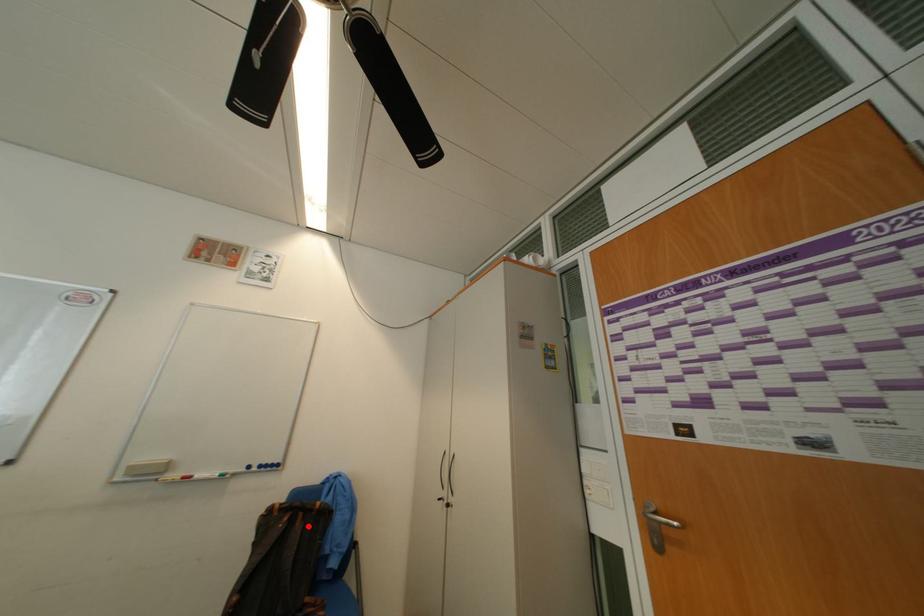
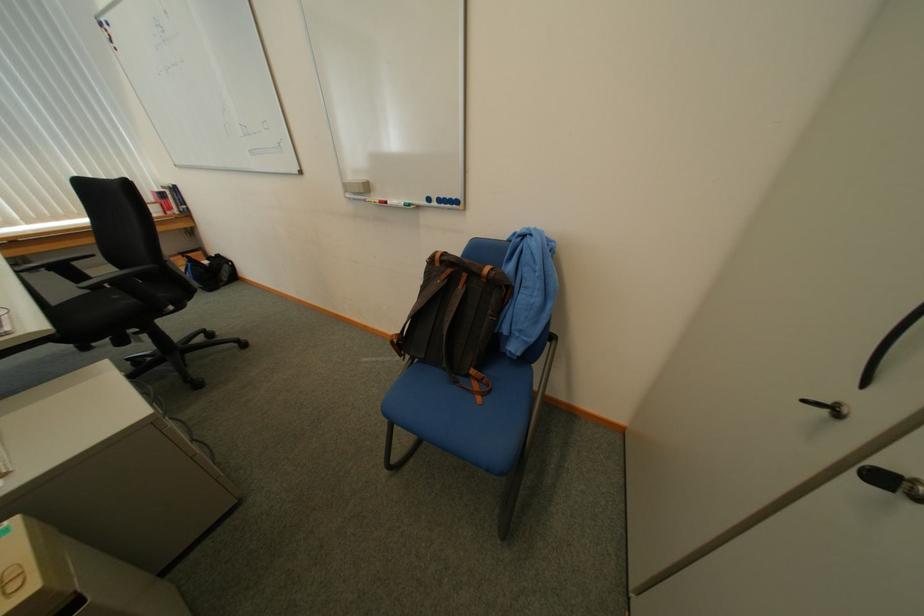
Question: I am providing you with two images of the same scene from different viewpoints. A red point is shown in image1. For the corresponding object point in image2, is it positioned nearer or farther from the camera?

Choices:
 (A) Nearer
 (B) Farther

Answer: (A)